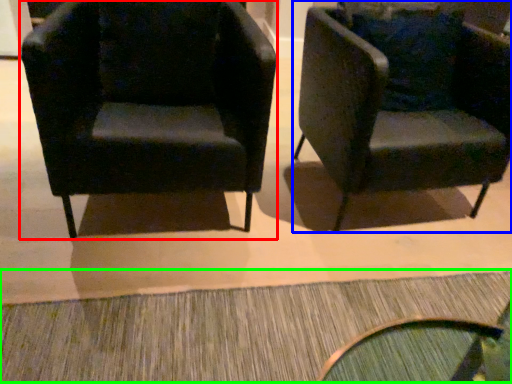
Question: Based on their relative distances, which object is farther from chair (highlighted by a red box)? Choose from chair (highlighted by a blue box) and doormat (highlighted by a green box).

Choices:
 (A) chair
 (B) doormat

Answer: (B)